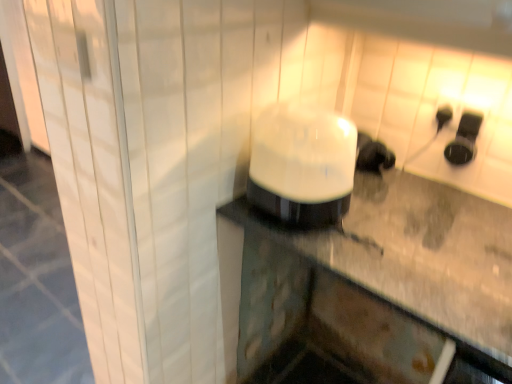
What do you see at coordinates (443, 116) in the screenshot? The image size is (512, 384). I see `black plastic outlet at upper right` at bounding box center [443, 116].

This screenshot has height=384, width=512. Identify the location of black plastic outlet at upper right. (443, 116).

Does black rubber earbuds at upper right, which is the 1th appliance from back to front, appear on the left side of white glossy humidifier at center, placed as the 2th appliance when sorted from right to left?

No.

In the scene shown: Looking at the image, does black rubber earbuds at upper right, which appears as the 2th appliance when viewed from the front, seem bigger or smaller compared to white glossy humidifier at center, placed as the 2th appliance when sorted from right to left?

In the image, black rubber earbuds at upper right, which appears as the 2th appliance when viewed from the front, appears to be smaller than white glossy humidifier at center, placed as the 2th appliance when sorted from right to left.

Is black rubber earbuds at upper right, which appears as the 2th appliance when viewed from the front, placed right next to white glossy humidifier at center, acting as the second appliance starting from the back?

They are not placed beside each other.

Would you say black rubber earbuds at upper right, the first appliance viewed from the right, is outside white glossy humidifier at center, marked as the first appliance in a left-to-right arrangement?

Yes, black rubber earbuds at upper right, the first appliance viewed from the right, is outside of white glossy humidifier at center, marked as the first appliance in a left-to-right arrangement.

Considering the relative positions of black plastic outlet at upper right and black rubber earbuds at upper right, the first appliance viewed from the right, in the image provided, is black plastic outlet at upper right in front of black rubber earbuds at upper right, the first appliance viewed from the right,?

No, black plastic outlet at upper right is behind black rubber earbuds at upper right, the first appliance viewed from the right.

Considering the relative positions of black plastic outlet at upper right and black rubber earbuds at upper right, which is the 1th appliance from back to front, in the image provided, is black plastic outlet at upper right to the right of black rubber earbuds at upper right, which is the 1th appliance from back to front, from the viewer's perspective?

No, black plastic outlet at upper right is not to the right of black rubber earbuds at upper right, which is the 1th appliance from back to front.

Do you think black plastic outlet at upper right is within black rubber earbuds at upper right, marked as the 2th appliance in a left-to-right arrangement, or outside of it?

black plastic outlet at upper right is not inside black rubber earbuds at upper right, marked as the 2th appliance in a left-to-right arrangement, it's outside.

Which of these two, black plastic outlet at upper right or black rubber earbuds at upper right, which appears as the 2th appliance when viewed from the front, is thinner?

With smaller width is black plastic outlet at upper right.

From a real-world perspective, does white glossy humidifier at center, marked as the first appliance in a left-to-right arrangement, sit lower than black rubber earbuds at upper right, marked as the 2th appliance in a left-to-right arrangement?

Indeed, from a real-world perspective, white glossy humidifier at center, marked as the first appliance in a left-to-right arrangement, is positioned beneath black rubber earbuds at upper right, marked as the 2th appliance in a left-to-right arrangement.

Considering the positions of objects white glossy humidifier at center, placed as the 2th appliance when sorted from right to left, and black rubber earbuds at upper right, which is the 1th appliance from back to front, in the image provided, who is more to the right, white glossy humidifier at center, placed as the 2th appliance when sorted from right to left, or black rubber earbuds at upper right, which is the 1th appliance from back to front,?

black rubber earbuds at upper right, which is the 1th appliance from back to front.

Which object is thinner, white glossy humidifier at center, which is counted as the 1th appliance, starting from the front, or black rubber earbuds at upper right, the first appliance viewed from the right?

With smaller width is black rubber earbuds at upper right, the first appliance viewed from the right.

Is black plastic outlet at upper right wider than white glossy humidifier at center, placed as the 2th appliance when sorted from right to left?

No, black plastic outlet at upper right is not wider than white glossy humidifier at center, placed as the 2th appliance when sorted from right to left.

Considering the positions of point (439, 116) and point (327, 114), is point (439, 116) closer or farther from the camera than point (327, 114)?

Point (439, 116).

Considering the sizes of black plastic outlet at upper right and white glossy humidifier at center, which is counted as the 1th appliance, starting from the front, in the image, is black plastic outlet at upper right bigger or smaller than white glossy humidifier at center, which is counted as the 1th appliance, starting from the front,?

black plastic outlet at upper right is smaller than white glossy humidifier at center, which is counted as the 1th appliance, starting from the front.

Considering the sizes of objects black plastic outlet at upper right and white glossy humidifier at center, placed as the 2th appliance when sorted from right to left, in the image provided, who is shorter, black plastic outlet at upper right or white glossy humidifier at center, placed as the 2th appliance when sorted from right to left,?

black plastic outlet at upper right.

From the image's perspective, is white glossy humidifier at center, marked as the first appliance in a left-to-right arrangement, beneath black plastic outlet at upper right?

Yes.

Would you say white glossy humidifier at center, acting as the second appliance starting from the back, is to the left or to the right of black plastic outlet at upper right in the picture?

white glossy humidifier at center, acting as the second appliance starting from the back, is to the left of black plastic outlet at upper right.

Is white glossy humidifier at center, placed as the 2th appliance when sorted from right to left, turned away from black plastic outlet at upper right?

Answer: Yes, white glossy humidifier at center, placed as the 2th appliance when sorted from right to left,'s orientation is away from black plastic outlet at upper right.

From the image's perspective, would you say black rubber earbuds at upper right, the first appliance viewed from the right, is shown under black plastic outlet at upper right?

Yes, from the image's perspective, black rubber earbuds at upper right, the first appliance viewed from the right, is beneath black plastic outlet at upper right.

Measure the distance from black rubber earbuds at upper right, which is the 1th appliance from back to front, to black plastic outlet at upper right.

black rubber earbuds at upper right, which is the 1th appliance from back to front, and black plastic outlet at upper right are 2.96 inches apart.

In the image, is black rubber earbuds at upper right, the first appliance viewed from the right, on the left side or the right side of black plastic outlet at upper right?

Clearly, black rubber earbuds at upper right, the first appliance viewed from the right, is on the right of black plastic outlet at upper right in the image.

Can we say black rubber earbuds at upper right, the first appliance viewed from the right, lies outside black plastic outlet at upper right?

Absolutely, black rubber earbuds at upper right, the first appliance viewed from the right, is external to black plastic outlet at upper right.

Identify the location of appliance located in front of the black rubber earbuds at upper right, the first appliance viewed from the right. (302, 165).

Locate an element on the screen. the 1st appliance positioned below the black plastic outlet at upper right (from the image's perspective) is located at coordinates (464, 139).

Estimate the real-world distances between objects in this image. Which object is closer to black rubber earbuds at upper right, which appears as the 2th appliance when viewed from the front, white glossy humidifier at center, acting as the second appliance starting from the back, or black plastic outlet at upper right?

black plastic outlet at upper right.

Which object lies nearer to the anchor point black rubber earbuds at upper right, which appears as the 2th appliance when viewed from the front, black plastic outlet at upper right or white glossy humidifier at center, acting as the second appliance starting from the back?

Among the two, black plastic outlet at upper right is located nearer to black rubber earbuds at upper right, which appears as the 2th appliance when viewed from the front.

Looking at this image, based on their spatial positions, is black rubber earbuds at upper right, which appears as the 2th appliance when viewed from the front, or white glossy humidifier at center, marked as the first appliance in a left-to-right arrangement, further from black plastic outlet at upper right?

The object further to black plastic outlet at upper right is white glossy humidifier at center, marked as the first appliance in a left-to-right arrangement.

Which object lies further to the anchor point white glossy humidifier at center, marked as the first appliance in a left-to-right arrangement, black rubber earbuds at upper right, marked as the 2th appliance in a left-to-right arrangement, or black plastic outlet at upper right?

The object further to white glossy humidifier at center, marked as the first appliance in a left-to-right arrangement, is black plastic outlet at upper right.

Which object lies nearer to the anchor point black plastic outlet at upper right, white glossy humidifier at center, acting as the second appliance starting from the back, or black rubber earbuds at upper right, marked as the 2th appliance in a left-to-right arrangement?

black rubber earbuds at upper right, marked as the 2th appliance in a left-to-right arrangement, lies closer to black plastic outlet at upper right than the other object.

When comparing their distances from white glossy humidifier at center, which is counted as the 1th appliance, starting from the front, does black plastic outlet at upper right or black rubber earbuds at upper right, marked as the 2th appliance in a left-to-right arrangement, seem closer?

Based on the image, black rubber earbuds at upper right, marked as the 2th appliance in a left-to-right arrangement, appears to be nearer to white glossy humidifier at center, which is counted as the 1th appliance, starting from the front.

In order to click on electric outlet located between white glossy humidifier at center, which is counted as the 1th appliance, starting from the front, and black rubber earbuds at upper right, marked as the 2th appliance in a left-to-right arrangement, in the left-right direction in this screenshot , I will do `click(443, 116)`.